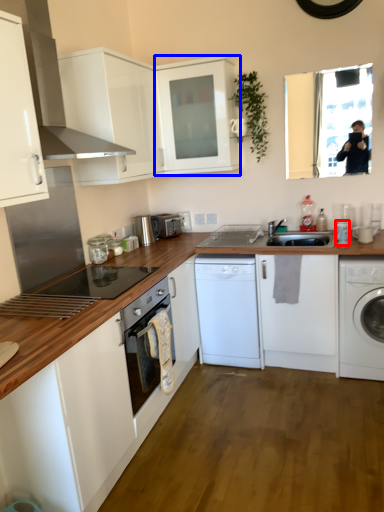
Question: Which object is closer to the camera taking this photo, appliance (highlighted by a red box) or cabinetry (highlighted by a blue box)?

Choices:
 (A) appliance
 (B) cabinetry

Answer: (B)